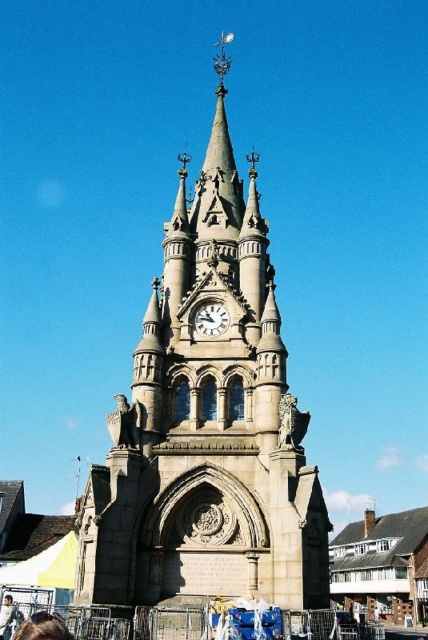
Question: Among these points, which one is farthest from the camera?

Choices:
 (A) (306, 413)
 (B) (211, 324)
 (C) (20, 616)

Answer: (B)

Question: Does brown hair at lower left have a lesser width compared to white stone clock at center?

Choices:
 (A) no
 (B) yes

Answer: (A)

Question: Is brown hair at lower left bigger than white stone clock at center?

Choices:
 (A) yes
 (B) no

Answer: (A)

Question: Estimate the real-world distances between objects in this image. Which object is closer to the brown hair at lower left?

Choices:
 (A) white stone clock at center
 (B) light brown leather jacket at lower left
 (C) stone clock tower at center

Answer: (B)

Question: Among these objects, which one is nearest to the camera?

Choices:
 (A) white stone clock at center
 (B) stone clock tower at center

Answer: (B)

Question: In this image, where is white stone clock at center located relative to light brown leather jacket at lower left?

Choices:
 (A) below
 (B) above

Answer: (B)